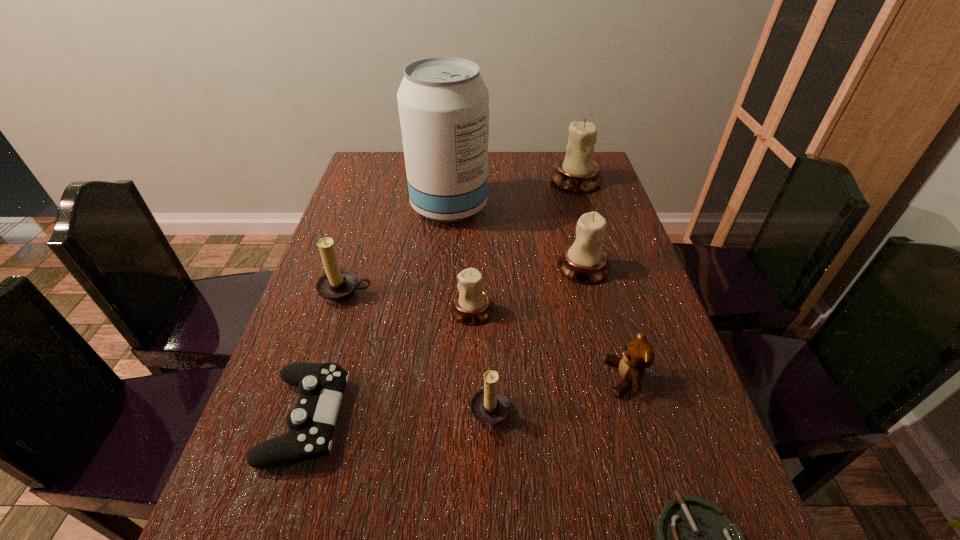
Identify the location of vacant space located on the wick of the nearer brown candle holder. The width and height of the screenshot is (960, 540). (269, 417).

Where is `free space located 0.100m on the front-facing side of the teddy bear`? free space located 0.100m on the front-facing side of the teddy bear is located at coordinates (558, 379).

Where is `free space located on the front-facing side of the teddy bear`? This screenshot has height=540, width=960. free space located on the front-facing side of the teddy bear is located at coordinates (424, 379).

Find the location of a particular element. The width and height of the screenshot is (960, 540). vacant space located 0.150m on the front-facing side of the teddy bear is located at coordinates (534, 379).

This screenshot has height=540, width=960. I want to click on vacant space located 0.340m on the surface of the second shortest object, so click(x=525, y=418).

The width and height of the screenshot is (960, 540). I want to click on alcohol that is at the far edge, so click(x=443, y=102).

The height and width of the screenshot is (540, 960). I want to click on candle holder that is at the far edge, so click(577, 172).

Where is `candle holder located in the left edge section of the desktop`? candle holder located in the left edge section of the desktop is located at coordinates (337, 285).

This screenshot has width=960, height=540. What are the coordinates of `control located at the left edge` in the screenshot? It's located at [x=321, y=386].

This screenshot has height=540, width=960. Identify the location of teddy bear situated at the right edge. (x=639, y=354).